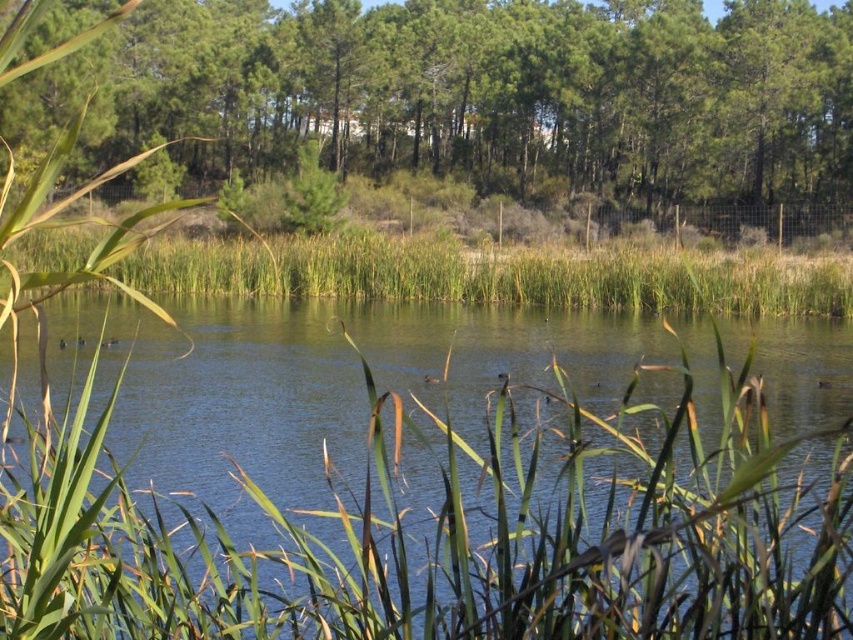
Looking at this image, between green grassy lake at center and green grass at center, which one appears on the left side from the viewer's perspective?

green grassy lake at center is more to the left.

From the picture: Between green grassy lake at center and green grass at center, which one has more height?

green grass at center

The width and height of the screenshot is (853, 640). Find the location of `green grassy lake at center`. green grassy lake at center is located at coordinates (428, 497).

Does green leafy trees at upper center appear on the left side of green grass at center?

Yes, green leafy trees at upper center is to the left of green grass at center.

Is point (222, 52) farther from viewer compared to point (614, 308)?

Yes, point (222, 52) is farther from viewer.

You are a GUI agent. You are given a task and a screenshot of the screen. Output one action in this format:
    pyautogui.click(x=<x>, y=<y>)
    Task: Click on the green leafy trees at upper center
    The width and height of the screenshot is (853, 640).
    Given the screenshot: What is the action you would take?
    pyautogui.click(x=486, y=97)

Can you confirm if green grassy lake at center is taller than green leafy trees at upper center?

In fact, green grassy lake at center may be shorter than green leafy trees at upper center.

Is green grassy lake at center in front of green leafy trees at upper center?

Yes.

Which is behind, point (405, 596) or point (397, 49)?

Point (397, 49)

Find the location of a particular element. green grassy lake at center is located at coordinates (428, 497).